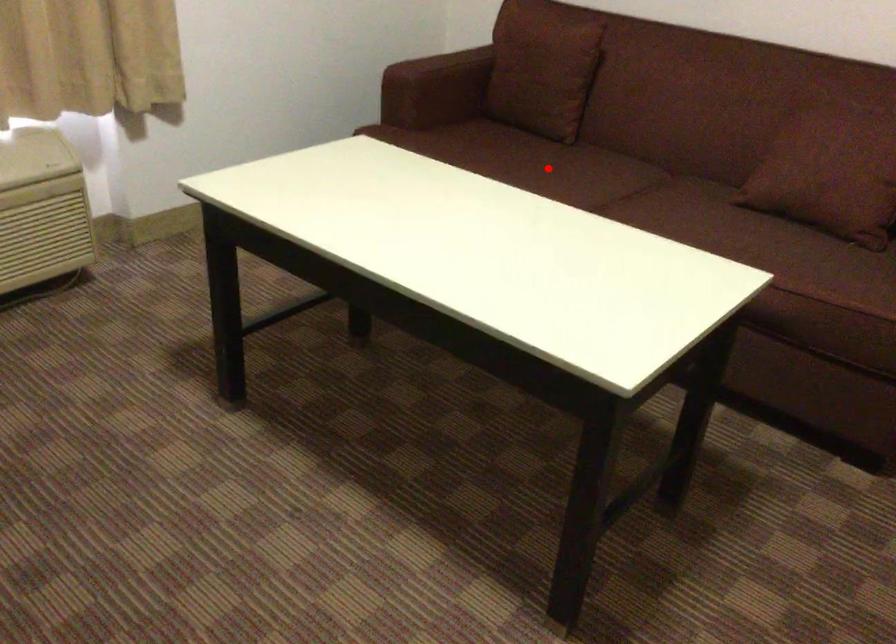
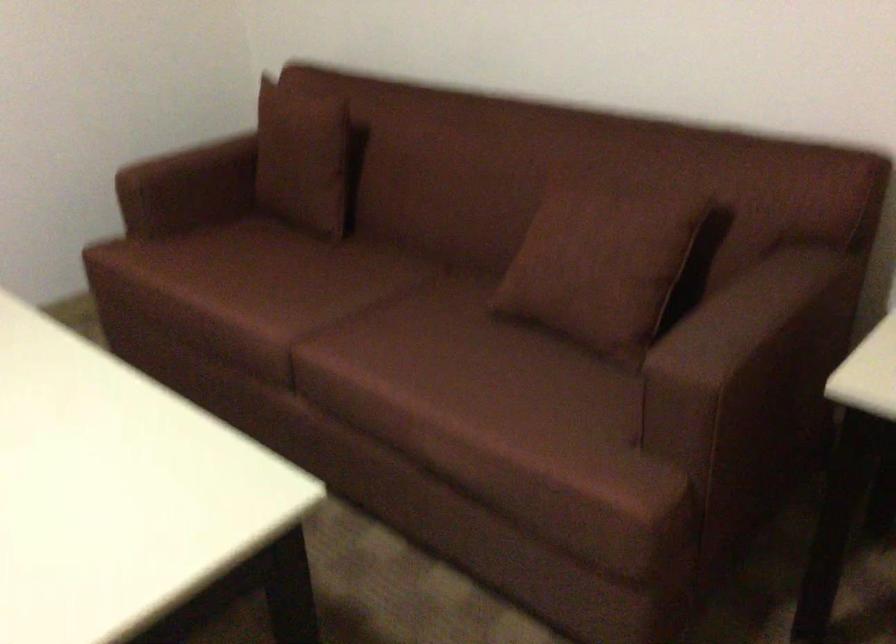
Question: I am providing you with two images of the same scene from different viewpoints. A red point is shown in image1. For the corresponding object point in image2, is it positioned nearer or farther from the camera?

Choices:
 (A) Nearer
 (B) Farther

Answer: (A)